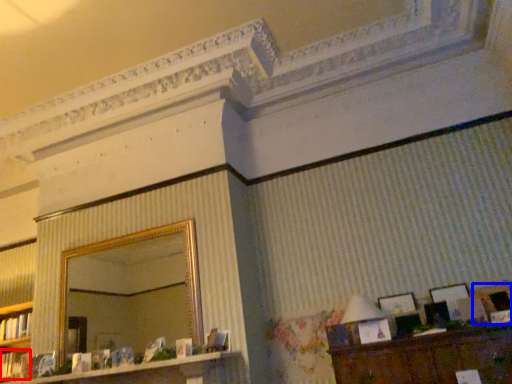
Question: Among these objects, which one is nearest to the camera, book (highlighted by a red box) or picture frame (highlighted by a blue box)?

Choices:
 (A) book
 (B) picture frame

Answer: (B)